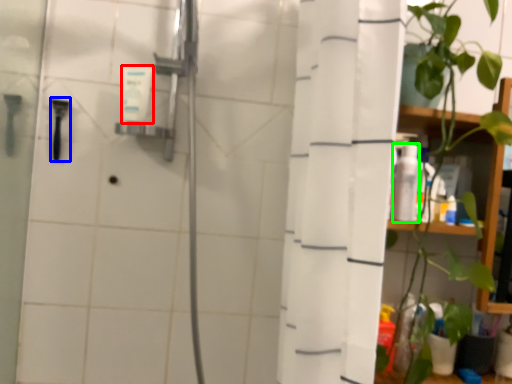
Question: Based on their relative distances, which object is nearer to toiletry (highlighted by a red box)? Choose from shower (highlighted by a blue box) and toiletry (highlighted by a green box).

Choices:
 (A) shower
 (B) toiletry

Answer: (A)